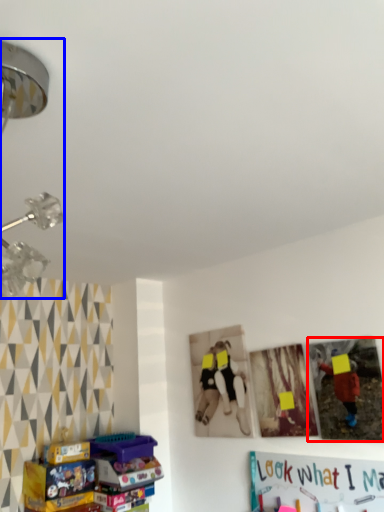
Question: Which point is further to the camera, picture frame (highlighted by a red box) or lamp (highlighted by a blue box)?

Choices:
 (A) picture frame
 (B) lamp

Answer: (A)